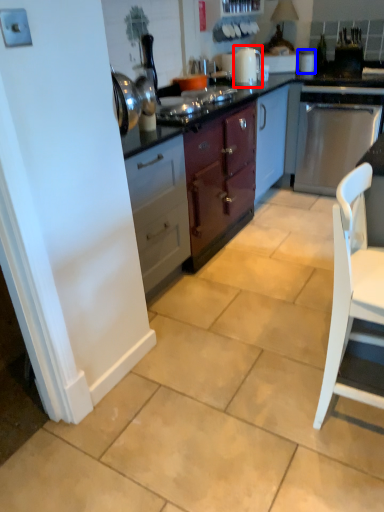
Question: Which object appears closest to the camera in this image, kitchen appliance (highlighted by a red box) or appliance (highlighted by a blue box)?

Choices:
 (A) kitchen appliance
 (B) appliance

Answer: (A)